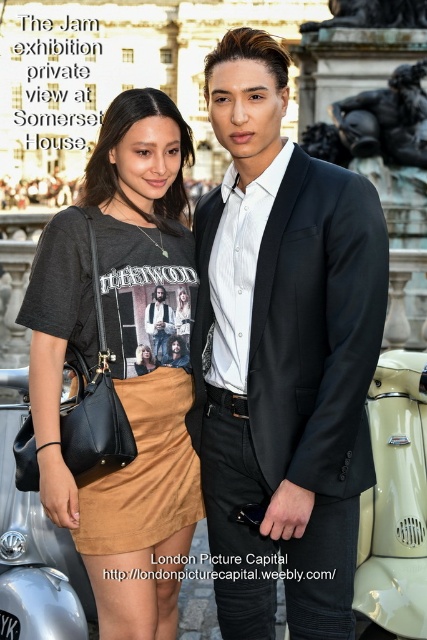
Can you confirm if matte black t-shirt at center is positioned above matte black suit at center?

Incorrect, matte black t-shirt at center is not positioned above matte black suit at center.

In the scene shown: Is matte black t-shirt at center thinner than matte black suit at center?

In fact, matte black t-shirt at center might be wider than matte black suit at center.

Who is more distant from viewer, (72, 518) or (155, 353)?

The point (155, 353) is behind.

The height and width of the screenshot is (640, 427). I want to click on matte black t-shirt at center, so click(122, 364).

Who is lower down, black smooth suit at center or matte black suit at center?

black smooth suit at center is below.

Looking at this image, does black smooth suit at center come in front of matte black suit at center?

Yes.

Does point (298, 285) come farther from viewer compared to point (149, 301)?

No, it is not.

Find the location of a particular element. black smooth suit at center is located at coordinates (287, 388).

I want to click on black smooth suit at center, so click(x=287, y=388).

Is black smooth suit at center further to the viewer compared to matte black t-shirt at center?

No.

Who is more forward, (x=289, y=422) or (x=116, y=324)?

Point (x=289, y=422)

Locate an element on the screen. black smooth suit at center is located at coordinates (287, 388).